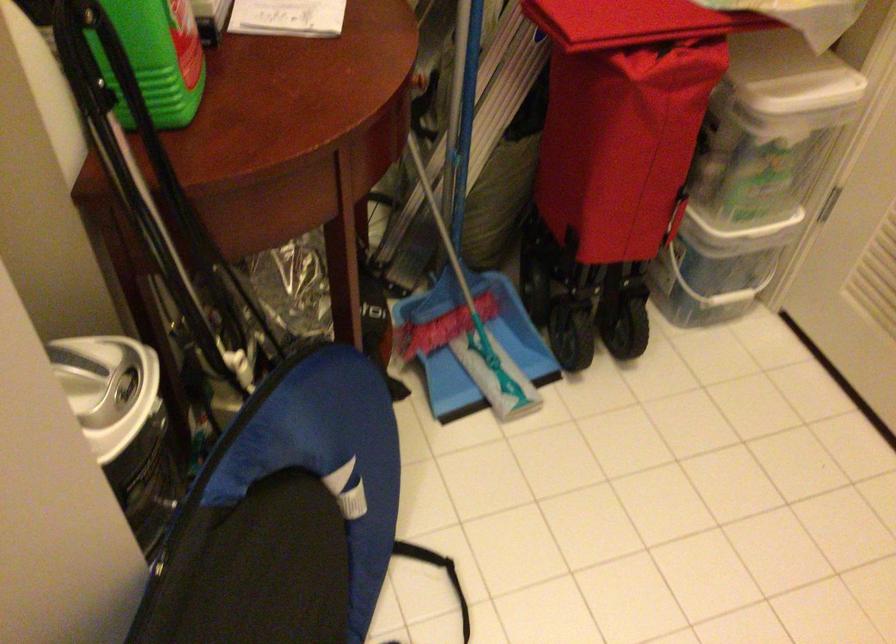
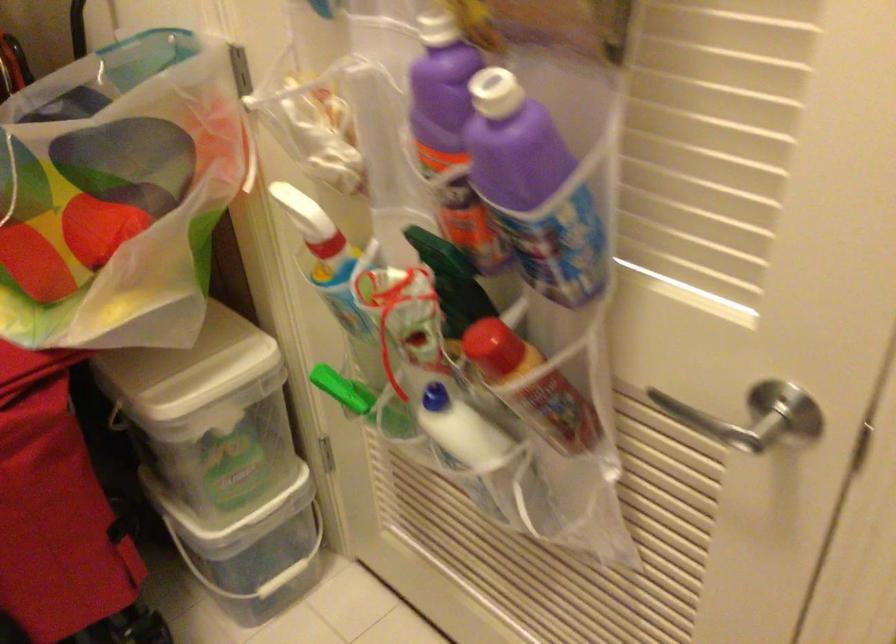
Question: Based on the continuous images, in which direction is the camera rotating? Reply with the corresponding letter.

Choices:
 (A) Left
 (B) Right
 (C) Up
 (D) Down

Answer: (B)